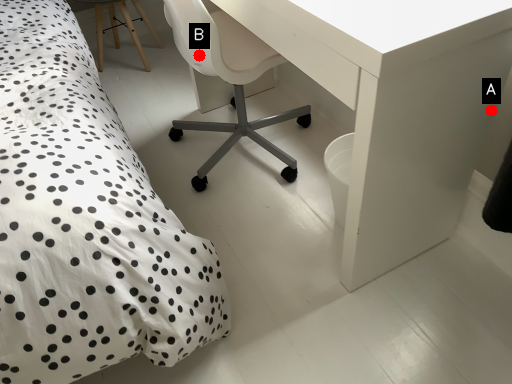
Question: Two points are circled on the image, labeled by A and B beside each circle. Which point is farther from the camera taking this photo?

Choices:
 (A) A is further
 (B) B is further

Answer: (B)